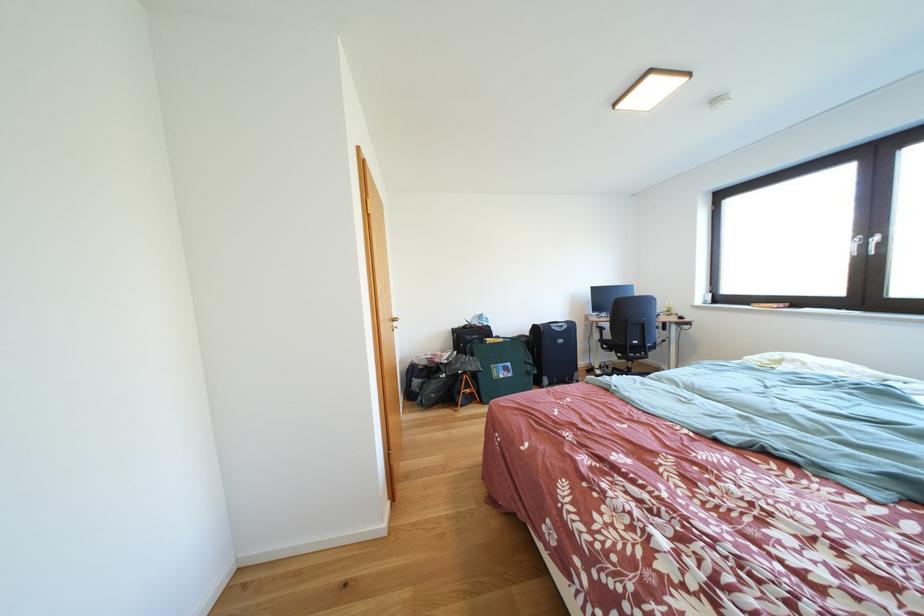
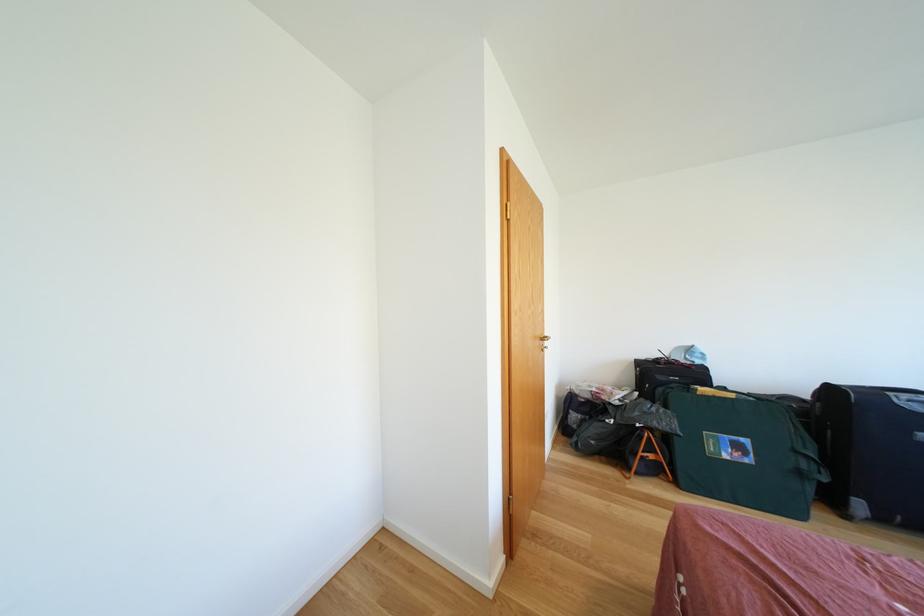
Where in the second image is the point corresponding to [511,345] from the first image?

(739, 400)